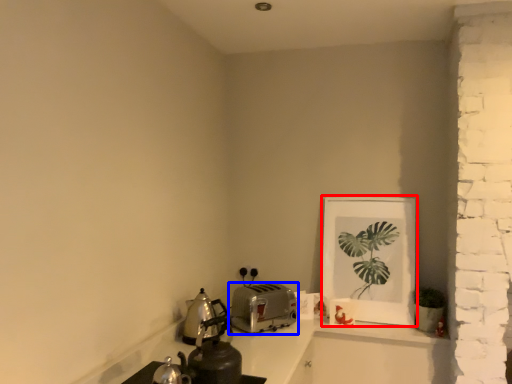
Question: Which object appears farthest to the camera in this image, picture frame (highlighted by a red box) or kitchen appliance (highlighted by a blue box)?

Choices:
 (A) picture frame
 (B) kitchen appliance

Answer: (A)